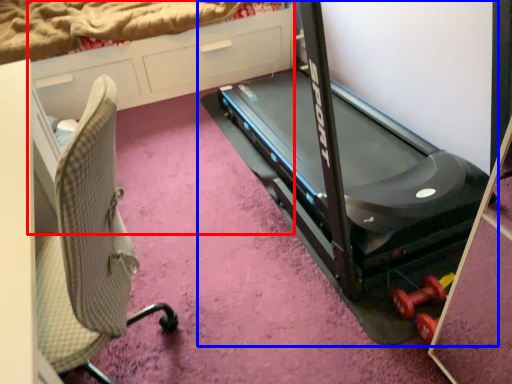
Question: Which object appears closest to the camera in this image, dresser (highlighted by a red box) or treadmill (highlighted by a blue box)?

Choices:
 (A) dresser
 (B) treadmill

Answer: (B)